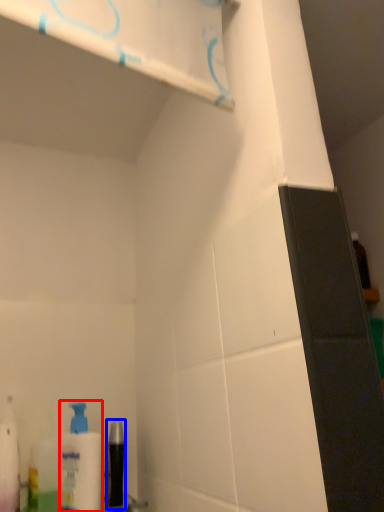
Question: Which object appears farthest to the camera in this image, cleaning product (highlighted by a red box) or mouthwash (highlighted by a blue box)?

Choices:
 (A) cleaning product
 (B) mouthwash

Answer: (B)